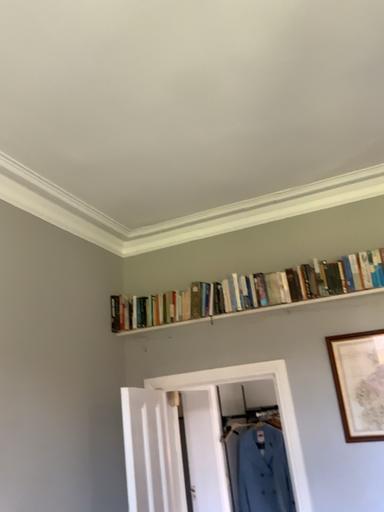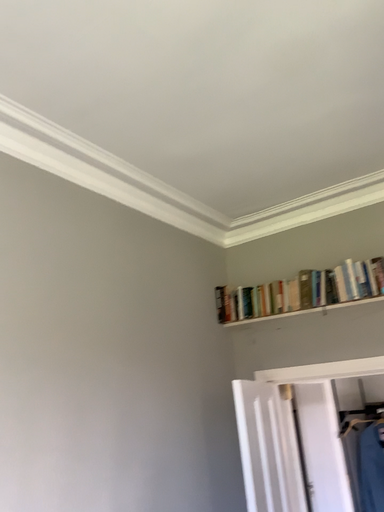
Question: How did the camera likely rotate when shooting the video?

Choices:
 (A) rotated left
 (B) rotated right

Answer: (A)